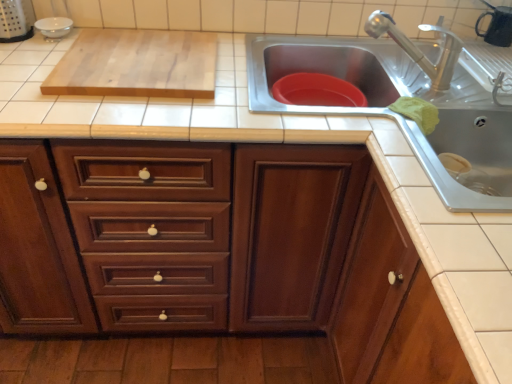
Question: From a real-world perspective, does stainless steel sink at upper right stand above wooden cabinet at center, which is the first cabinetry from left to right?

Choices:
 (A) no
 (B) yes

Answer: (B)

Question: Is stainless steel sink at upper right closer to the viewer compared to wooden cabinet at center, placed as the 2th cabinetry when sorted from right to left?

Choices:
 (A) yes
 (B) no

Answer: (B)

Question: Can you confirm if stainless steel sink at upper right is positioned to the left of wooden cabinet at center, which is the first cabinetry from left to right?

Choices:
 (A) no
 (B) yes

Answer: (A)

Question: Would you say stainless steel sink at upper right is outside wooden cabinet at center, which is the first cabinetry from left to right?

Choices:
 (A) yes
 (B) no

Answer: (B)

Question: Is stainless steel sink at upper right positioned far away from wooden cabinet at center, which is the first cabinetry from left to right?

Choices:
 (A) yes
 (B) no

Answer: (B)

Question: Considering the relative sizes of stainless steel sink at upper right and wooden cabinet at center, placed as the 2th cabinetry when sorted from right to left, in the image provided, is stainless steel sink at upper right thinner than wooden cabinet at center, placed as the 2th cabinetry when sorted from right to left,?

Choices:
 (A) no
 (B) yes

Answer: (B)

Question: Can you confirm if stainless steel sink at upper right is bigger than light wood cutting board at upper left?

Choices:
 (A) no
 (B) yes

Answer: (B)

Question: Does stainless steel sink at upper right appear on the left side of light wood cutting board at upper left?

Choices:
 (A) yes
 (B) no

Answer: (B)

Question: Could you tell me if stainless steel sink at upper right is facing light wood cutting board at upper left?

Choices:
 (A) no
 (B) yes

Answer: (A)

Question: Is stainless steel sink at upper right positioned with its back to light wood cutting board at upper left?

Choices:
 (A) no
 (B) yes

Answer: (A)

Question: From the image's perspective, is stainless steel sink at upper right beneath light wood cutting board at upper left?

Choices:
 (A) yes
 (B) no

Answer: (A)

Question: Is stainless steel sink at upper right thinner than light wood cutting board at upper left?

Choices:
 (A) yes
 (B) no

Answer: (B)

Question: Is light wood cutting board at upper left not inside wooden cabinet at center, placed as the 2th cabinetry when sorted from right to left?

Choices:
 (A) no
 (B) yes

Answer: (B)